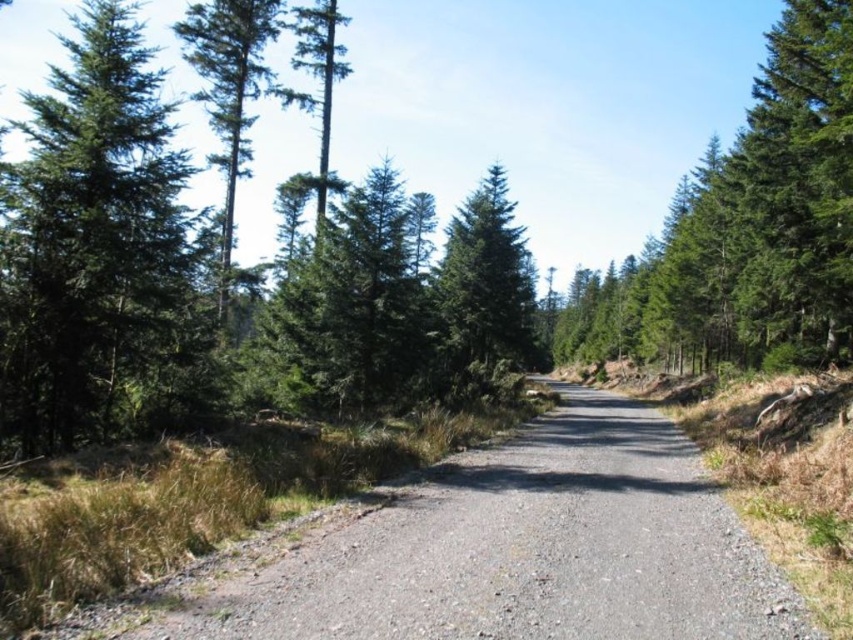
You are a hiker planning to walk along the gray gravel road at center and pass by the green matte tree at left. If you want to know which one is taller, which object should you measure?

The green matte tree at left is taller than the gray gravel road at center.

You are a hiker planning to take a photo of the green matte tree at left and the green matte tree at upper right from a position along the gravel path. Based on their positions, which tree would appear closer to the camera in the photo?

The green matte tree at left would appear closer to the camera because it is positioned above the green matte tree at upper right in the image, indicating it is nearer in the visual plane.